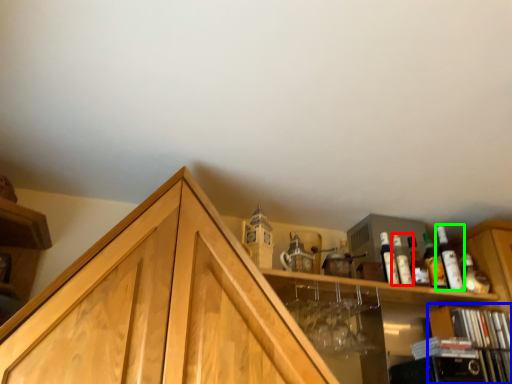
Question: Which is farther away from bottle (highlighted by a red box)? cabinetry (highlighted by a blue box) or bottle (highlighted by a green box)?

Choices:
 (A) cabinetry
 (B) bottle

Answer: (A)